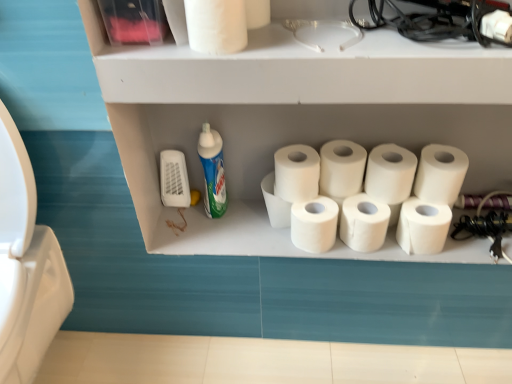
Question: From the image's perspective, is white matte toilet paper at center, which is the 8th toilet paper from left to right, positioned above or below white matte toilet paper at center, which is counted as the fifth toilet paper, starting from the left?

Choices:
 (A) below
 (B) above

Answer: (B)

Question: In the image, is white matte toilet paper at center, which is the 8th toilet paper from left to right, on the left side or the right side of white matte toilet paper at center, which is counted as the seventh toilet paper, starting from the right?

Choices:
 (A) right
 (B) left

Answer: (A)

Question: Which object is the closest to the blue glossy bottle at center-left?

Choices:
 (A) white matte toilet paper at right, the 9th toilet paper in the left-to-right sequence
 (B) white matte toilet paper at upper right, placed as the 10th toilet paper when sorted from left to right
 (C) white matte toilet paper at upper center, the 11th toilet paper in the right-to-left sequence
 (D) white matte toilet paper at center, which ranks as the 6th toilet paper in left-to-right order
 (E) white matte toilet paper at center, positioned as the 3th toilet paper in left-to-right order

Answer: (E)

Question: Considering the real-world distances, which object is closest to the white matte toilet paper at upper center, placed as the 1th toilet paper when sorted from left to right?

Choices:
 (A) white matte toilet paper at right, positioned as the 11th toilet paper in left-to-right order
 (B) white matte shelf at upper center
 (C) white matte toilet paper at center, which is the 8th toilet paper from left to right
 (D) white matte toilet paper at center, which appears as the 5th toilet paper when viewed from the right
 (E) white matte toilet paper at center, which is counted as the fifth toilet paper, starting from the left

Answer: (B)